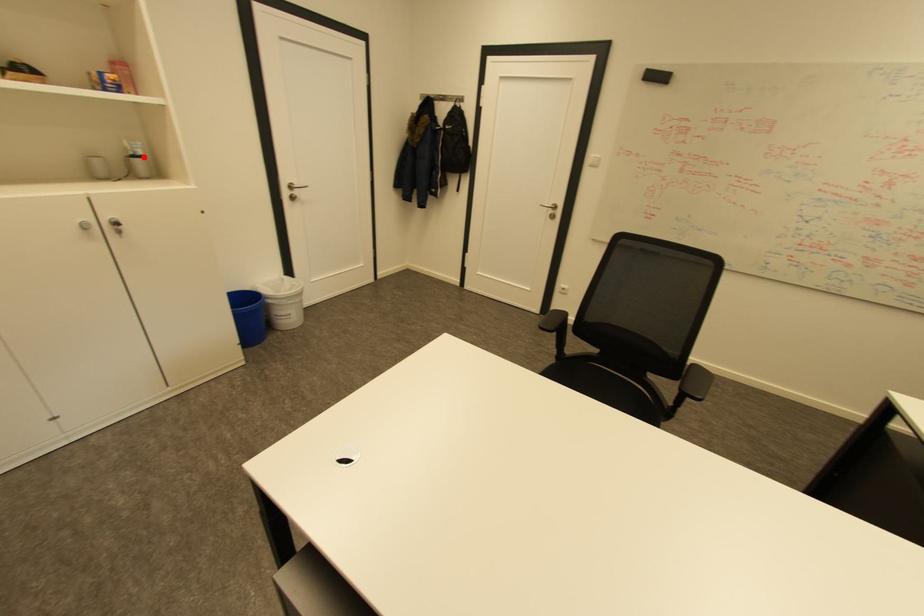
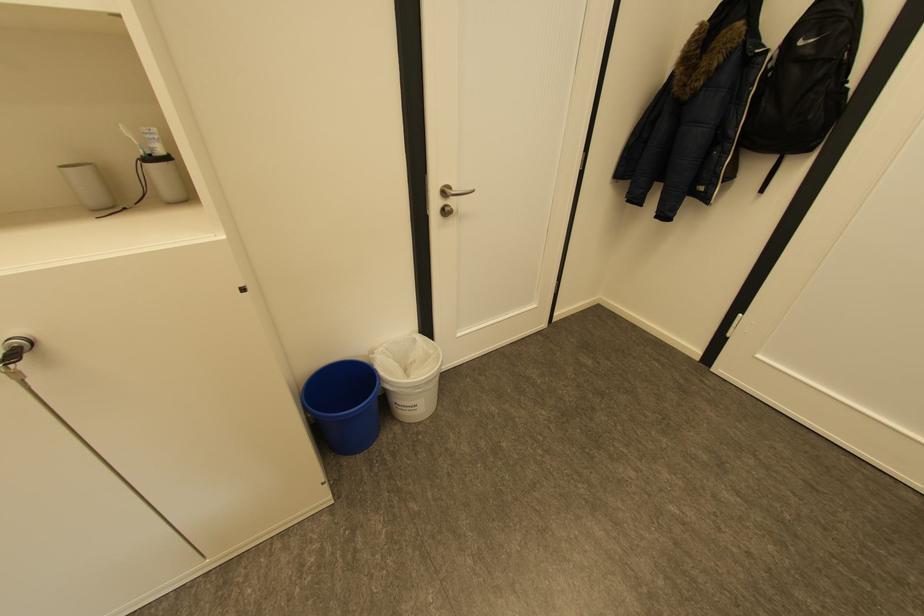
Find the pixel in the second image that matches the highlighted location in the first image.

(157, 159)